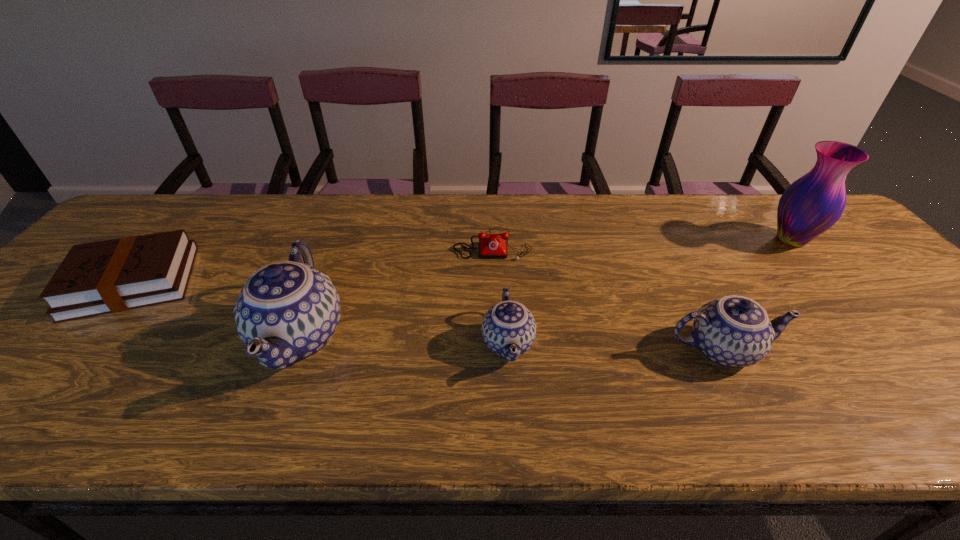
This screenshot has height=540, width=960. What are the coordinates of `free location at the far edge` in the screenshot? It's located at (589, 212).

Locate an element on the screen. The image size is (960, 540). vacant area at the near edge of the desktop is located at coordinates (393, 376).

Where is `vacant area at the left edge of the desktop`? The width and height of the screenshot is (960, 540). vacant area at the left edge of the desktop is located at coordinates (46, 346).

This screenshot has width=960, height=540. In the image, there is a desktop. Identify the location of vacant area at the right edge. (946, 338).

This screenshot has height=540, width=960. In the image, there is a desktop. Identify the location of vacant area at the far right corner. coord(760,198).

At what (x,y) coordinates should I click in order to perform the action: click on free space between the vase and the shortest object. Please return your answer as a coordinate pair (x, y). Looking at the image, I should click on (641, 242).

Identify the location of empty location between the telephone and the fourth shortest object. The image size is (960, 540). (607, 297).

Where is `free space that is in between the telephone and the second chinaware from left to right`? The image size is (960, 540). free space that is in between the telephone and the second chinaware from left to right is located at coordinates (500, 293).

This screenshot has width=960, height=540. In order to click on free space between the fifth tallest object and the second tallest chinaware in this screenshot , I will do `click(427, 316)`.

This screenshot has width=960, height=540. I want to click on vacant region between the telephone and the shortest chinaware, so click(500, 293).